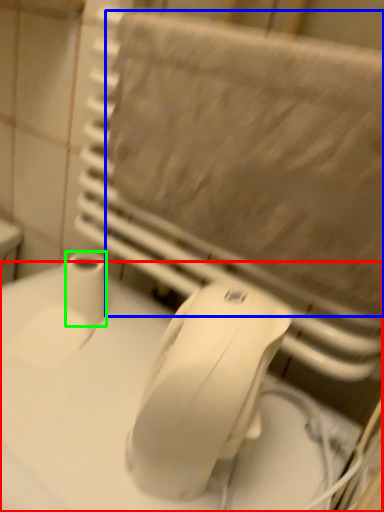
Question: Considering the real-world distances, which object is closest to counter top (highlighted by a red box)? bath towel (highlighted by a blue box) or toilet paper (highlighted by a green box).

Choices:
 (A) bath towel
 (B) toilet paper

Answer: (B)